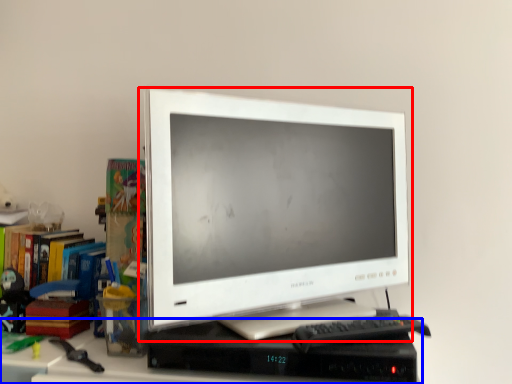
Question: Which of the following is the farthest to the observer, computer monitor (highlighted by a red box) or computer desk (highlighted by a blue box)?

Choices:
 (A) computer monitor
 (B) computer desk

Answer: (A)